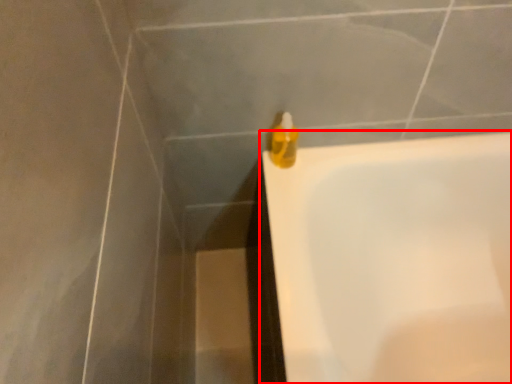
Question: From the image's perspective, where is bathtub (annotated by the red box) located in relation to liquid in the image?

Choices:
 (A) above
 (B) below

Answer: (B)